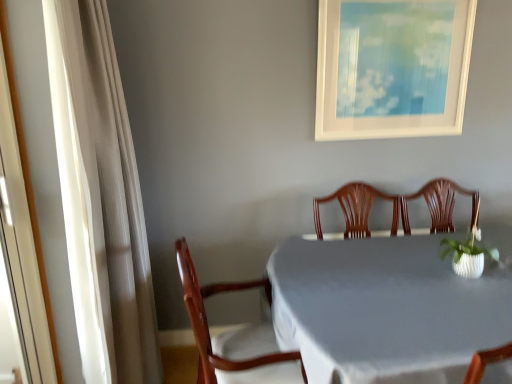
The height and width of the screenshot is (384, 512). What do you see at coordinates (100, 198) in the screenshot?
I see `white sheer curtain at left` at bounding box center [100, 198].

Find the location of a particular element. wooden chair at center is located at coordinates (234, 337).

Describe the element at coordinates (28, 184) in the screenshot. The width and height of the screenshot is (512, 384). I see `white glossy screen door at left` at that location.

The image size is (512, 384). I want to click on white cloth-covered table at center, so click(x=384, y=309).

What do you see at coordinates (467, 247) in the screenshot? The height and width of the screenshot is (384, 512). I see `white textured vase at right` at bounding box center [467, 247].

Image resolution: width=512 pixels, height=384 pixels. I want to click on white sheer curtain at left, so click(100, 198).

Between point (436, 59) and point (277, 314), which one is positioned in front?

The point (277, 314) is in front.

Locate an element on the screen. The width and height of the screenshot is (512, 384). picture frame that is above the white cloth-covered table at center (from the image's perspective) is located at coordinates (392, 67).

How far apart are white matte picture frame at upper center and white cloth-covered table at center?

white matte picture frame at upper center and white cloth-covered table at center are 37.05 inches apart.

Is white matte picture frame at upper center with white cloth-covered table at center?

No, white matte picture frame at upper center is not touching white cloth-covered table at center.

From the image's perspective, is white cloth-covered table at center on wooden chair at center?

Actually, white cloth-covered table at center appears below wooden chair at center in the image.

Is white cloth-covered table at center aimed at wooden chair at center?

No, white cloth-covered table at center is not turned towards wooden chair at center.

Can you confirm if white cloth-covered table at center is bigger than wooden chair at center?

Correct, white cloth-covered table at center is larger in size than wooden chair at center.

From the image's perspective, would you say white sheer curtain at left is positioned over white cloth-covered table at center?

Yes, from the image's perspective, white sheer curtain at left is on top of white cloth-covered table at center.

Which object is positioned more to the left, white sheer curtain at left or white cloth-covered table at center?

white sheer curtain at left is more to the left.

Can you confirm if white sheer curtain at left is smaller than white cloth-covered table at center?

Indeed, white sheer curtain at left has a smaller size compared to white cloth-covered table at center.

Does point (82, 207) come farther from viewer compared to point (324, 293)?

No, it is in front of (324, 293).

Does white textured vase at right have a lesser width compared to wooden chair at center?

Yes.

Is the position of white textured vase at right more distant than that of wooden chair at center?

Yes, it is behind wooden chair at center.

From a real-world perspective, is white textured vase at right located higher than wooden chair at center?

Yes, from a real-world perspective, white textured vase at right is over wooden chair at center

Considering the positions of objects wooden chair at center and white glossy screen door at left in the image provided, who is in front, wooden chair at center or white glossy screen door at left?

white glossy screen door at left is in front.

Identify the location of chair lying on the right of white glossy screen door at left. (234, 337).

How different are the orientations of wooden chair at center and white glossy screen door at left in degrees?

0.9 degrees separate the facing orientations of wooden chair at center and white glossy screen door at left.

From the image's perspective, is wooden chair at center under white glossy screen door at left?

Yes, from the image's perspective, wooden chair at center is beneath white glossy screen door at left.

Can you confirm if white textured vase at right is bigger than white cloth-covered table at center?

Actually, white textured vase at right might be smaller than white cloth-covered table at center.

Considering the sizes of objects white textured vase at right and white cloth-covered table at center in the image provided, who is taller, white textured vase at right or white cloth-covered table at center?

white cloth-covered table at center is taller.

Consider the image. Which object is further away from the camera taking this photo, white textured vase at right or white cloth-covered table at center?

Positioned behind is white textured vase at right.

Does point (456, 250) come closer to viewer compared to point (376, 382)?

No, (456, 250) is further to viewer.

Is white cloth-covered table at center further to the viewer compared to white matte picture frame at upper center?

No, white cloth-covered table at center is closer to the viewer.

Between point (291, 237) and point (325, 33), which one is positioned in front?

Point (325, 33)

Between white cloth-covered table at center and white matte picture frame at upper center, which one has larger width?

white cloth-covered table at center is wider.

Where is `picture frame behind the white cloth-covered table at center`? The image size is (512, 384). picture frame behind the white cloth-covered table at center is located at coordinates (392, 67).

Where is `table that is below the white matte picture frame at upper center (from the image's perspective)`? This screenshot has width=512, height=384. table that is below the white matte picture frame at upper center (from the image's perspective) is located at coordinates (384, 309).

Where is `chair on the left of the white cloth-covered table at center`? This screenshot has width=512, height=384. chair on the left of the white cloth-covered table at center is located at coordinates (234, 337).

When comparing their distances from white cloth-covered table at center, does white matte picture frame at upper center or wooden chair at center seem closer?

Based on the image, wooden chair at center appears to be nearer to white cloth-covered table at center.

Which object lies nearer to the anchor point white textured vase at right, white sheer curtain at left or white glossy screen door at left?

Among the two, white sheer curtain at left is located nearer to white textured vase at right.

Considering their positions, is white matte picture frame at upper center positioned closer to white textured vase at right than wooden chair at center?

white matte picture frame at upper center is positioned closer to the anchor white textured vase at right.

When comparing their distances from white sheer curtain at left, does white glossy screen door at left or white matte picture frame at upper center seem closer?

white glossy screen door at left lies closer to white sheer curtain at left than the other object.

Which object lies further to the anchor point white matte picture frame at upper center, white glossy screen door at left or white sheer curtain at left?

white glossy screen door at left is positioned further to the anchor white matte picture frame at upper center.

When comparing their distances from white cloth-covered table at center, does white matte picture frame at upper center or white glossy screen door at left seem further?

white glossy screen door at left.

Based on their spatial positions, is wooden chair at center or white textured vase at right closer to white glossy screen door at left?

The object closer to white glossy screen door at left is wooden chair at center.

Looking at the image, which one is located closer to wooden chair at center, white sheer curtain at left or white glossy screen door at left?

Among the two, white sheer curtain at left is located nearer to wooden chair at center.

Image resolution: width=512 pixels, height=384 pixels. Find the location of `chair between white sheer curtain at left and white matte picture frame at upper center from left to right`. chair between white sheer curtain at left and white matte picture frame at upper center from left to right is located at coordinates [234, 337].

The image size is (512, 384). In order to click on floral arrangement between white matte picture frame at upper center and white cloth-covered table at center from top to bottom in this screenshot , I will do `click(467, 247)`.

This screenshot has height=384, width=512. In order to click on table between white sheer curtain at left and white textured vase at right from left to right in this screenshot , I will do `click(384, 309)`.

The width and height of the screenshot is (512, 384). What are the coordinates of `chair between white matte picture frame at upper center and white cloth-covered table at center in the up-down direction` in the screenshot? It's located at (234, 337).